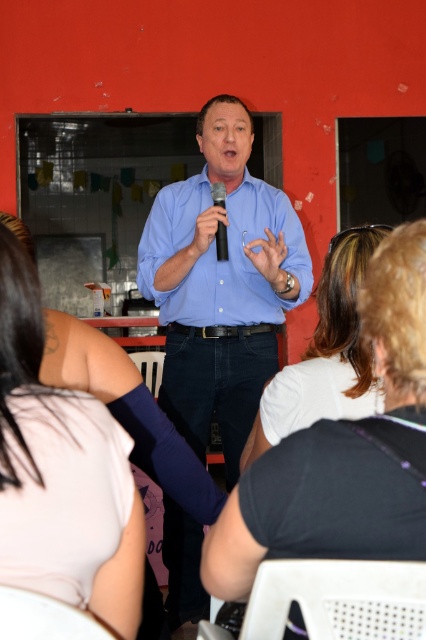
Does white fabric shirt at center appear over blue button-up shirt at center?

No, white fabric shirt at center is not above blue button-up shirt at center.

Who is more distant from viewer, (273, 454) or (232, 272)?

The point (232, 272) is more distant.

I want to click on white fabric shirt at center, so click(x=344, y=451).

The image size is (426, 640). What do you see at coordinates (215, 253) in the screenshot?
I see `blue button-up shirt at center` at bounding box center [215, 253].

Is point (207, 296) positioned before point (291, 417)?

No, (207, 296) is behind (291, 417).

Where is `blue button-up shirt at center`? Image resolution: width=426 pixels, height=640 pixels. blue button-up shirt at center is located at coordinates (215, 253).

Consider the image. Between pink fabric arm at left and blue button-up shirt at center, which one has more height?

Standing taller between the two is blue button-up shirt at center.

Who is positioned more to the right, pink fabric arm at left or blue button-up shirt at center?

From the viewer's perspective, blue button-up shirt at center appears more on the right side.

Describe the element at coordinates (62, 464) in the screenshot. This screenshot has height=640, width=426. I see `pink fabric arm at left` at that location.

At what (x,y) coordinates should I click in order to perform the action: click on pink fabric arm at left. Please return your answer as a coordinate pair (x, y). Image resolution: width=426 pixels, height=640 pixels. Looking at the image, I should click on (62, 464).